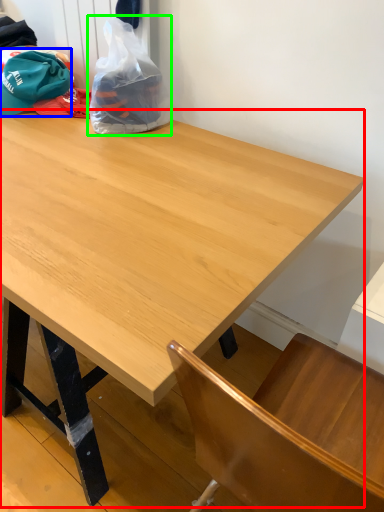
Question: Which object is positioned farthest from table (highlighted by a red box)? Select from baseball hat (highlighted by a blue box) and plastic bag (highlighted by a green box).

Choices:
 (A) baseball hat
 (B) plastic bag

Answer: (A)